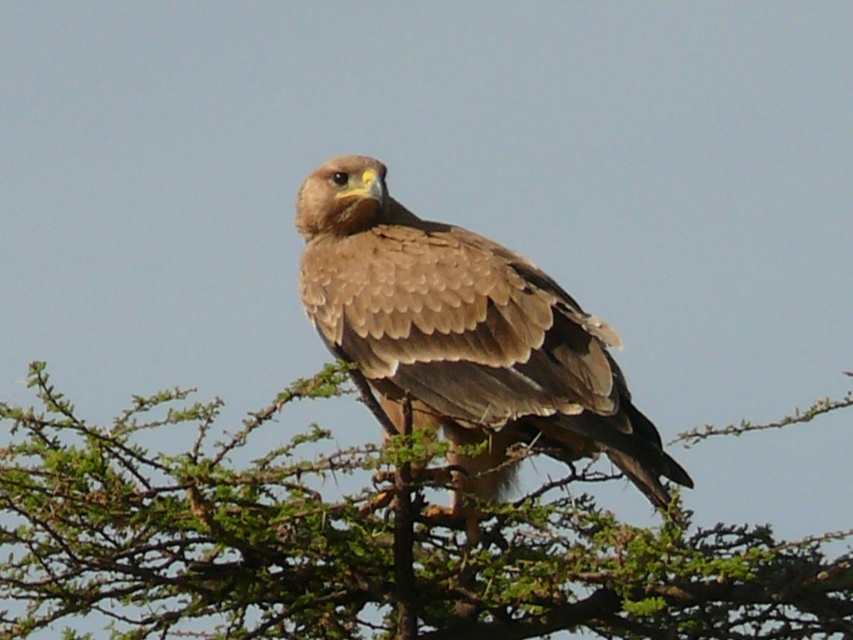
Question: Can you confirm if green leafy tree at center is positioned to the right of brown feathered eagle at center?

Choices:
 (A) yes
 (B) no

Answer: (B)

Question: Does green leafy tree at center have a lesser width compared to brown feathered eagle at center?

Choices:
 (A) no
 (B) yes

Answer: (A)

Question: Is green leafy tree at center bigger than brown feathered eagle at center?

Choices:
 (A) no
 (B) yes

Answer: (B)